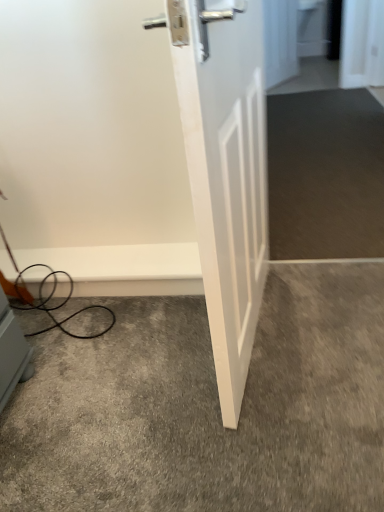
Question: From a real-world perspective, does gray carpet at lower center sit lower than white matte door at center?

Choices:
 (A) yes
 (B) no

Answer: (A)

Question: Considering the relative sizes of gray carpet at lower center and white matte door at center in the image provided, is gray carpet at lower center taller than white matte door at center?

Choices:
 (A) yes
 (B) no

Answer: (B)

Question: Considering the relative sizes of gray carpet at lower center and white matte door at center in the image provided, is gray carpet at lower center bigger than white matte door at center?

Choices:
 (A) yes
 (B) no

Answer: (B)

Question: Is gray carpet at lower center closer to camera compared to white matte door at center?

Choices:
 (A) yes
 (B) no

Answer: (B)

Question: Does gray carpet at lower center have a smaller size compared to white matte door at center?

Choices:
 (A) yes
 (B) no

Answer: (A)

Question: From the image's perspective, is gray carpet at lower center on top of white matte door at center?

Choices:
 (A) yes
 (B) no

Answer: (B)

Question: Does white matte door at center have a smaller size compared to gray carpet at lower center?

Choices:
 (A) yes
 (B) no

Answer: (B)

Question: From a real-world perspective, does white matte door at center stand above gray carpet at lower center?

Choices:
 (A) yes
 (B) no

Answer: (A)

Question: Is gray carpet at lower center surrounded by white matte door at center?

Choices:
 (A) no
 (B) yes

Answer: (A)

Question: Is white matte door at center further to the viewer compared to gray carpet at lower center?

Choices:
 (A) yes
 (B) no

Answer: (B)

Question: Considering the relative sizes of white matte door at center and gray carpet at lower center in the image provided, is white matte door at center thinner than gray carpet at lower center?

Choices:
 (A) no
 (B) yes

Answer: (B)

Question: Can you confirm if white matte door at center is positioned to the left of gray carpet at lower center?

Choices:
 (A) yes
 (B) no

Answer: (B)

Question: Would you say white matte door at center is to the left or to the right of gray carpet at lower center in the picture?

Choices:
 (A) left
 (B) right

Answer: (B)